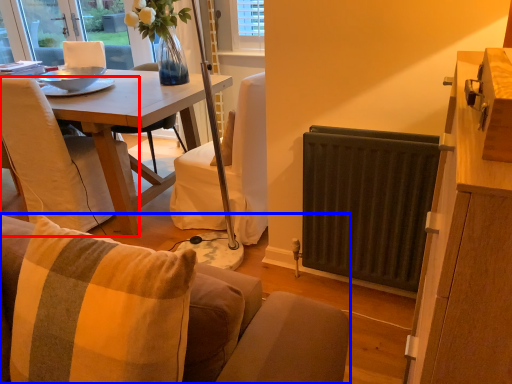
Question: Which object appears closest to the camera in this image, chair (highlighted by a red box) or studio couch (highlighted by a blue box)?

Choices:
 (A) chair
 (B) studio couch

Answer: (B)